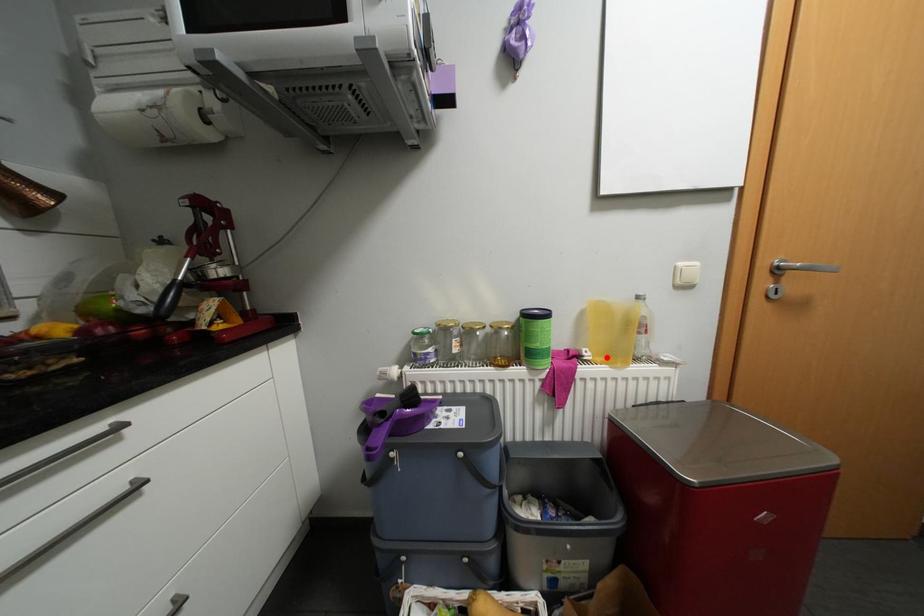
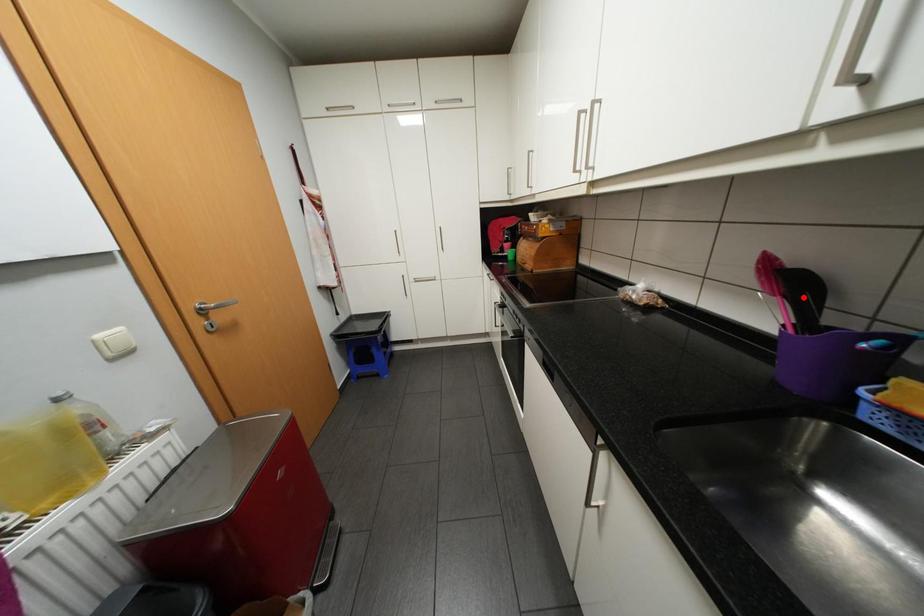
I am providing you with two images of the same scene from different viewpoints. A red point is marked on the first image and another point is marked on the second image. Is the marked point in image1 the same physical position as the marked point in image2?

No